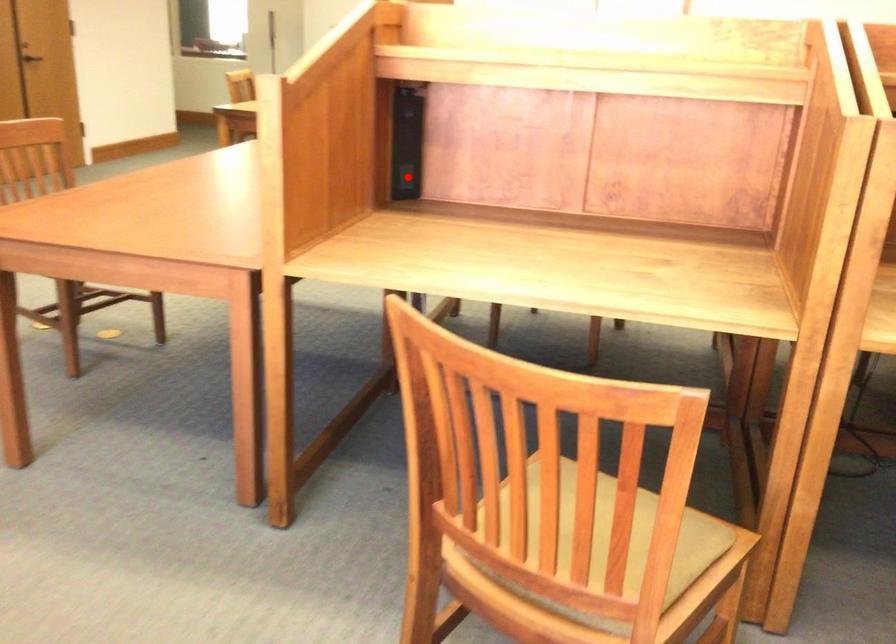
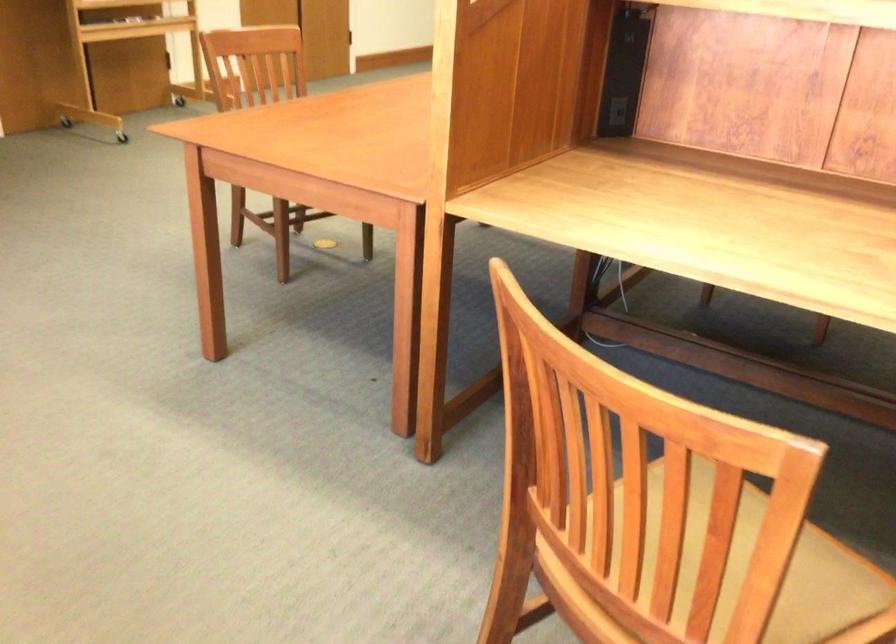
Question: I am providing you with two images of the same scene from different viewpoints. In image1, a red point is highlighted. Considering the same 3D point in image2, which of the following is correct?

Choices:
 (A) It is closer
 (B) It is farther

Answer: (A)